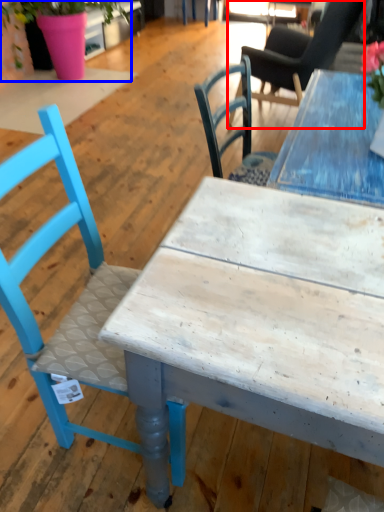
Question: Which of the following is the farthest to the observer, chair (highlighted by a red box) or houseplant (highlighted by a blue box)?

Choices:
 (A) chair
 (B) houseplant

Answer: (B)